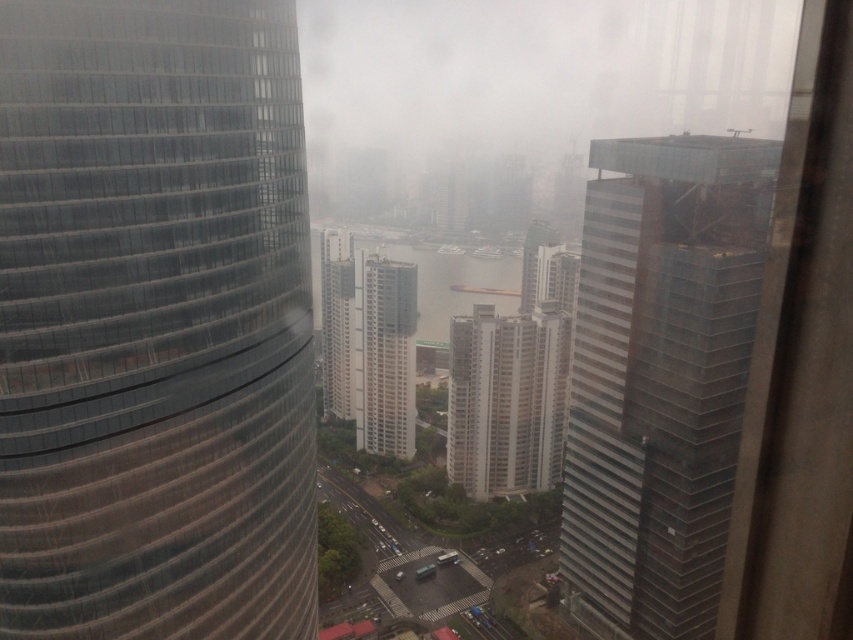
Question: Which point is closer to the camera taking this photo?

Choices:
 (A) [x=328, y=276]
 (B) [x=392, y=410]
 (C) [x=199, y=470]
 (D) [x=718, y=593]

Answer: (C)

Question: Does white textured building at center have a greater width compared to white glass building at center?

Choices:
 (A) no
 (B) yes

Answer: (B)

Question: Is transparent glass skyscraper at right further to camera compared to white textured building at center?

Choices:
 (A) no
 (B) yes

Answer: (A)

Question: Which of the following is the closest to the observer?

Choices:
 (A) white textured building at center
 (B) white glass building at center
 (C) transparent glass tower at left

Answer: (C)

Question: Is the position of transparent glass skyscraper at right more distant than that of white glass building at center?

Choices:
 (A) yes
 (B) no

Answer: (B)

Question: Which point is closer to the camera?

Choices:
 (A) transparent glass skyscraper at right
 (B) white textured building at center
 (C) white glass building at center
 (D) transparent glass tower at left

Answer: (D)